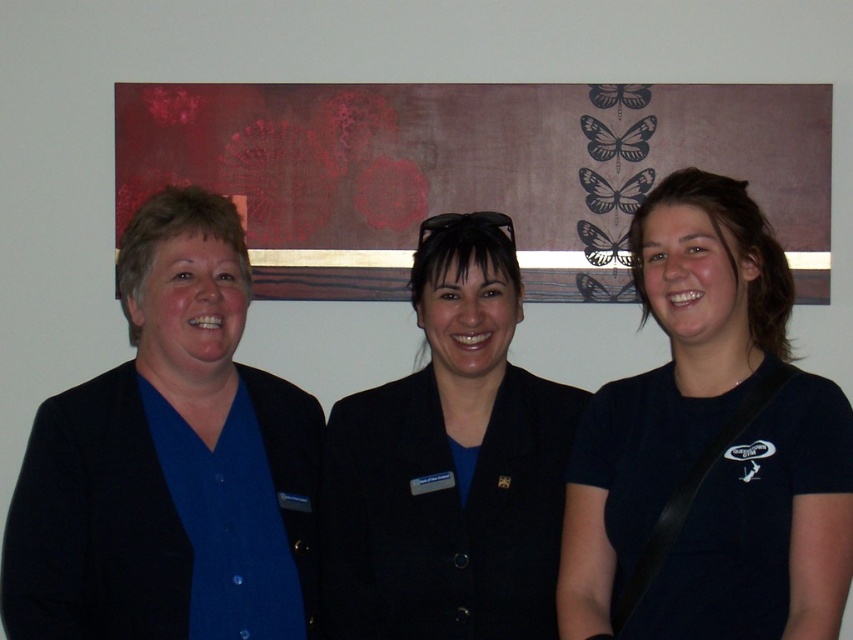
Question: Which point is farther from the camera taking this photo?

Choices:
 (A) (756, 209)
 (B) (372, 536)
 (C) (250, 426)

Answer: (C)

Question: Does black matte shirt at center appear on the right side of blue matte shirt at center?

Choices:
 (A) no
 (B) yes

Answer: (B)

Question: Which of the following is the farthest from the observer?

Choices:
 (A) (500, 356)
 (B) (198, 572)

Answer: (A)

Question: Does blue matte shirt at center have a greater width compared to black matte blazer at center?

Choices:
 (A) no
 (B) yes

Answer: (A)

Question: Which object appears farthest from the camera in this image?

Choices:
 (A) blue matte shirt at center
 (B) black matte shirt at center
 (C) black matte blazer at center

Answer: (C)

Question: Can you confirm if black matte shirt at center is bigger than blue matte shirt at center?

Choices:
 (A) no
 (B) yes

Answer: (A)